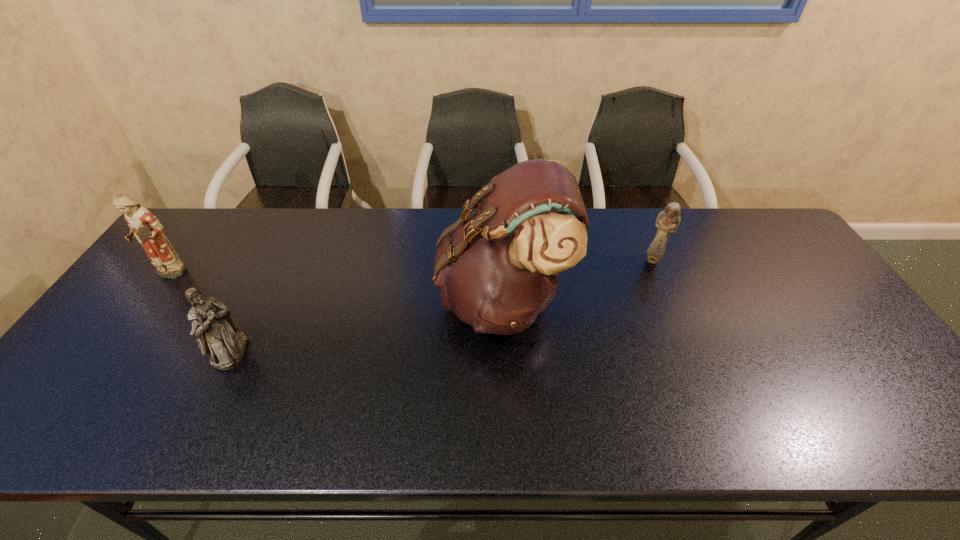
This screenshot has height=540, width=960. In order to click on free space located on the front-facing side of the third shortest object in this screenshot , I will do `click(96, 375)`.

Locate an element on the screen. vacant region located on the front-facing side of the nearest figurine is located at coordinates (326, 352).

This screenshot has height=540, width=960. Identify the location of vacant space situated on the front-facing side of the rightmost figurine. (691, 349).

You are a GUI agent. You are given a task and a screenshot of the screen. Output one action in this format:
    pyautogui.click(x=<x>, y=<y>)
    Task: Click on the satchel at the far edge
    This screenshot has width=960, height=540.
    Given the screenshot: What is the action you would take?
    pyautogui.click(x=497, y=269)

Image resolution: width=960 pixels, height=540 pixels. Find the location of `figurine that is at the far edge`. figurine that is at the far edge is located at coordinates (668, 220).

This screenshot has height=540, width=960. What are the coordinates of `object that is at the left edge` in the screenshot? It's located at (145, 227).

In the image, there is a desktop. Identify the location of free region at the far edge. (340, 212).

I want to click on free location at the near edge, so click(x=346, y=420).

You are a GUI agent. You are given a task and a screenshot of the screen. Output one action in this format:
    pyautogui.click(x=<x>, y=<y>)
    Task: Click on the vacant space at the left edge of the desktop
    
    Given the screenshot: What is the action you would take?
    pyautogui.click(x=192, y=287)

This screenshot has height=540, width=960. In the image, there is a desktop. In order to click on vacant space at the right edge in this screenshot , I will do `click(816, 293)`.